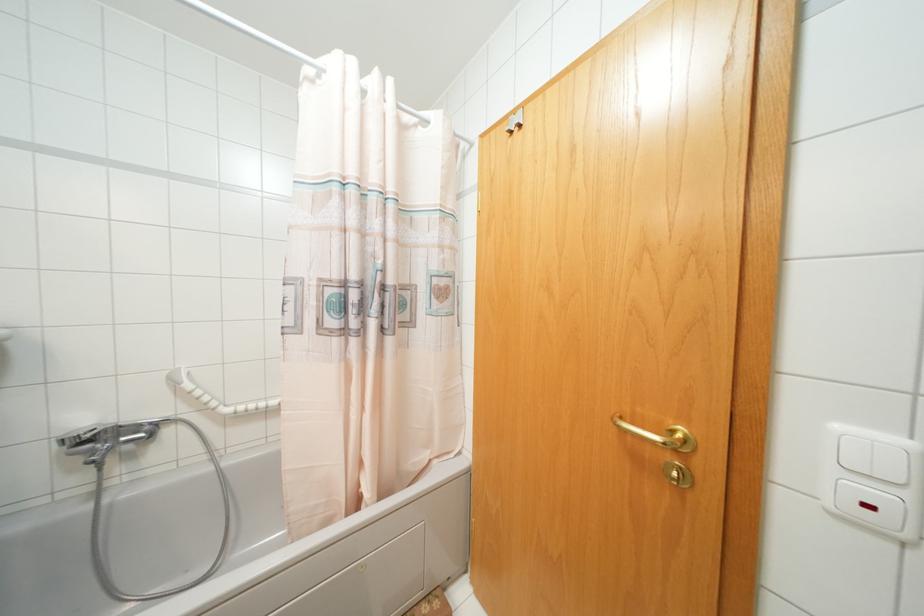
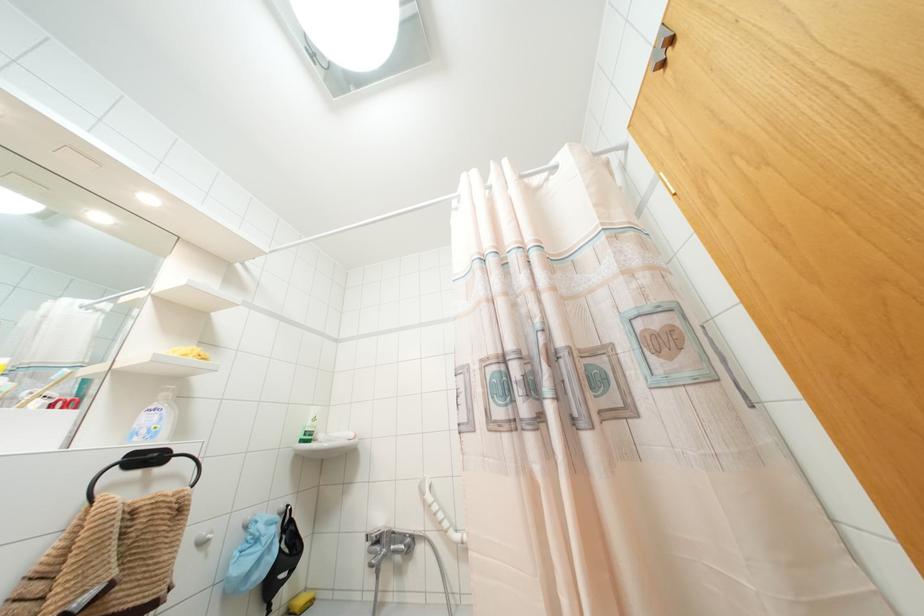
First-person continuous shooting, in which direction is the camera rotating?

The rotation direction of the camera is left-up.